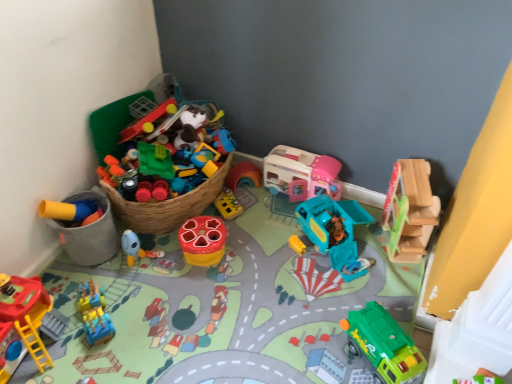
Image resolution: width=512 pixels, height=384 pixels. I want to click on free area in between green matte truck at lower right, which is the 7th toy from left to right, and rubberized plastic toy at center, positioned as the fourth toy in left-to-right order, so tap(281, 296).